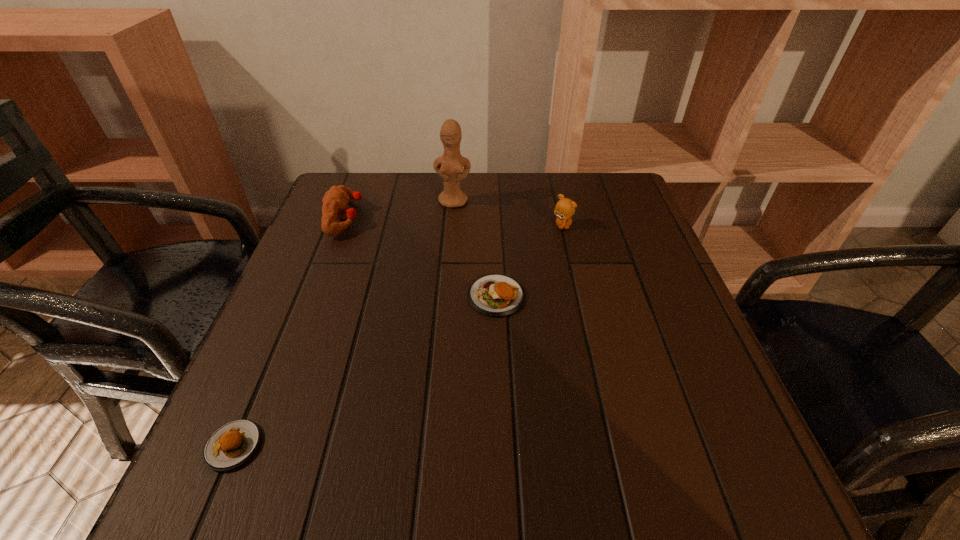
Locate an element on the screen. the tallest object is located at coordinates coord(449,167).

You are a GUI agent. You are given a task and a screenshot of the screen. Output one action in this format:
    pyautogui.click(x=<x>, y=<y>)
    Task: Click on the rightmost object
    This screenshot has height=540, width=960.
    Given the screenshot: What is the action you would take?
    pyautogui.click(x=565, y=208)

Identify the location of puncher. Image resolution: width=960 pixels, height=540 pixels. click(335, 201).

Where is `the farther food`? the farther food is located at coordinates (495, 295).

Image resolution: width=960 pixels, height=540 pixels. In order to click on the fourth tallest object in this screenshot , I will do `click(495, 295)`.

You are a GUI agent. You are given a task and a screenshot of the screen. Output one action in this format:
    pyautogui.click(x=<x>, y=<y>)
    Task: Click on the shortest object
    
    Given the screenshot: What is the action you would take?
    pyautogui.click(x=232, y=444)

Image resolution: width=960 pixels, height=540 pixels. Identify the location of the left food. (232, 444).

Where is `blank area located on the front-facing side of the figurine`? The width and height of the screenshot is (960, 540). blank area located on the front-facing side of the figurine is located at coordinates (447, 282).

The height and width of the screenshot is (540, 960). What are the coordinates of `blank area located 0.270m on the face of the teddy bear` in the screenshot? It's located at (583, 315).

This screenshot has height=540, width=960. I want to click on free space located 0.320m with the gloves of the puncher facing forward, so pyautogui.click(x=491, y=218).